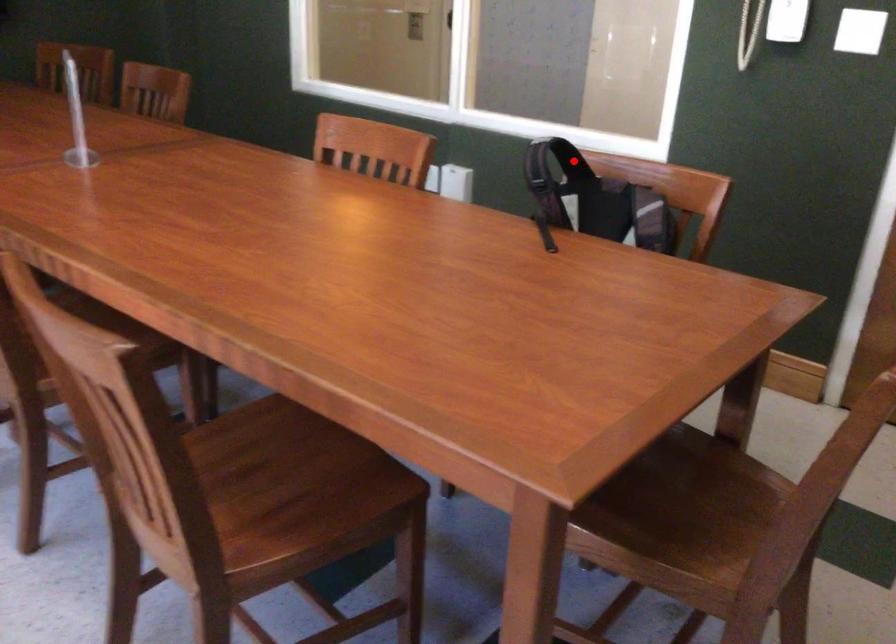
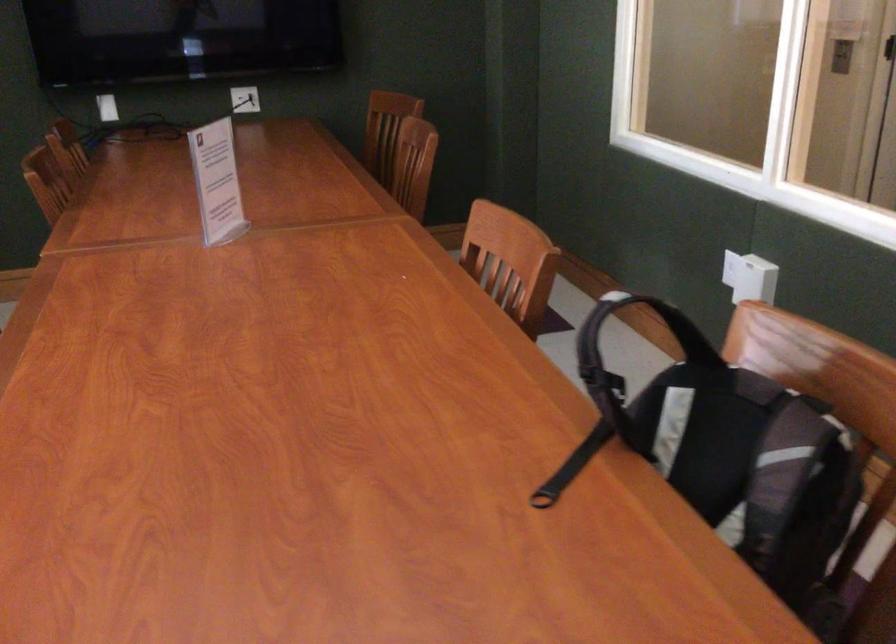
Question: I am providing you with two images of the same scene from different viewpoints. Given a red point in image1, look at the same physical point in image2. Is it:

Choices:
 (A) Closer to the viewpoint
 (B) Farther from the viewpoint

Answer: (A)